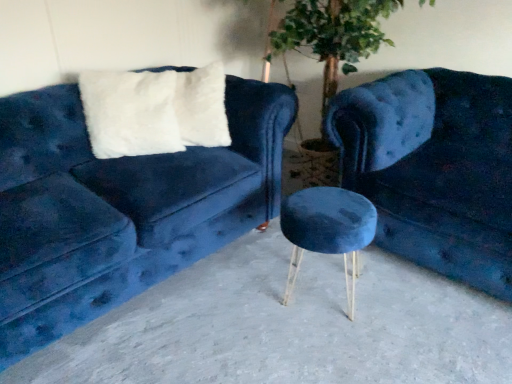
The height and width of the screenshot is (384, 512). In order to click on smooth concrete stool at center in this screenshot , I will do `click(286, 327)`.

You are a GUI agent. You are given a task and a screenshot of the screen. Output one action in this format:
    pyautogui.click(x=<x>, y=<y>)
    Task: Click on the velvet blue couch at center, placed as the second studio couch when sorted from left to right
    The height and width of the screenshot is (384, 512).
    Given the screenshot: What is the action you would take?
    pyautogui.click(x=434, y=169)

The height and width of the screenshot is (384, 512). What do you see at coordinates (120, 207) in the screenshot?
I see `velvet blue couch at left, marked as the 2th studio couch in a right-to-left arrangement` at bounding box center [120, 207].

Image resolution: width=512 pixels, height=384 pixels. In order to click on white fluffy pillow at upper left in this screenshot , I will do `click(202, 106)`.

Would you say white fluffy pillow at upper left contains velvet blue couch at center, placed as the second studio couch when sorted from left to right?

Definitely not — velvet blue couch at center, placed as the second studio couch when sorted from left to right, is not inside white fluffy pillow at upper left.

Between white fluffy pillow at upper left and velvet blue couch at center, the first studio couch viewed from the right, which one is positioned behind?

white fluffy pillow at upper left is further from the camera.

This screenshot has height=384, width=512. What are the coordinates of `the 1st studio couch in front when counting from the white fluffy pillow at upper left` in the screenshot? It's located at (434, 169).

From a real-world perspective, which is physically below, white fluffy pillow at upper left or velvet blue couch at center, the first studio couch viewed from the right?

From a 3D spatial view, velvet blue couch at center, the first studio couch viewed from the right, is below.

Considering the positions of objects smooth concrete stool at center and velvet blue stool at center in the image provided, who is more to the left, smooth concrete stool at center or velvet blue stool at center?

smooth concrete stool at center is more to the left.

This screenshot has width=512, height=384. In order to click on bar stool behind the smooth concrete stool at center in this screenshot , I will do `click(327, 230)`.

Considering the sizes of objects smooth concrete stool at center and velvet blue stool at center in the image provided, who is wider, smooth concrete stool at center or velvet blue stool at center?

Wider between the two is smooth concrete stool at center.

Is smooth concrete stool at center oriented away from velvet blue stool at center?

smooth concrete stool at center does not have its back to velvet blue stool at center.

Is velvet blue couch at left, which is counted as the 1th studio couch, starting from the left, not inside velvet blue couch at center, placed as the second studio couch when sorted from left to right?

Yes, velvet blue couch at left, which is counted as the 1th studio couch, starting from the left, is outside of velvet blue couch at center, placed as the second studio couch when sorted from left to right.

In terms of height, does velvet blue couch at left, marked as the 2th studio couch in a right-to-left arrangement, look taller or shorter compared to velvet blue couch at center, placed as the second studio couch when sorted from left to right?

In the image, velvet blue couch at left, marked as the 2th studio couch in a right-to-left arrangement, appears to be taller than velvet blue couch at center, placed as the second studio couch when sorted from left to right.

Does point (17, 321) come behind point (410, 143)?

No, (17, 321) is closer to viewer.

Which studio couch is the 2nd one when counting from the front of the white fluffy pillow at upper left? Please provide its 2D coordinates.

[(120, 207)]

Which is behind, point (70, 92) or point (224, 83)?

Point (224, 83)

From a real-world perspective, is velvet blue couch at left, which is counted as the 1th studio couch, starting from the left, physically below white fluffy pillow at upper left?

Yes, from a real-world perspective, velvet blue couch at left, which is counted as the 1th studio couch, starting from the left, is beneath white fluffy pillow at upper left.

Who is taller, velvet blue couch at left, marked as the 2th studio couch in a right-to-left arrangement, or white fluffy pillow at upper left?

Standing taller between the two is velvet blue couch at left, marked as the 2th studio couch in a right-to-left arrangement.

Is velvet blue stool at center aimed at velvet blue couch at center, placed as the second studio couch when sorted from left to right?

No.

Considering the sizes of velvet blue stool at center and velvet blue couch at center, the first studio couch viewed from the right, in the image, is velvet blue stool at center wider or thinner than velvet blue couch at center, the first studio couch viewed from the right,?

In the image, velvet blue stool at center appears to be more narrow than velvet blue couch at center, the first studio couch viewed from the right.

Is velvet blue stool at center positioned before velvet blue couch at center, the first studio couch viewed from the right?

That is False.

Is there a large distance between white fluffy pillow at upper left and smooth concrete stool at center?

Actually, white fluffy pillow at upper left and smooth concrete stool at center are a little close together.

From the image's perspective, is white fluffy pillow at upper left located beneath smooth concrete stool at center?

No, from the image's perspective, white fluffy pillow at upper left is not below smooth concrete stool at center.

Is white fluffy pillow at upper left looking in the opposite direction of smooth concrete stool at center?

No.

Based on the photo, considering the relative positions of white fluffy pillow at upper left and smooth concrete stool at center in the image provided, is white fluffy pillow at upper left in front of smooth concrete stool at center?

No, it is behind smooth concrete stool at center.

Does velvet blue couch at center, the first studio couch viewed from the right, have a lesser width compared to white fluffy pillow at upper left?

In fact, velvet blue couch at center, the first studio couch viewed from the right, might be wider than white fluffy pillow at upper left.

From the picture: Is velvet blue couch at center, placed as the second studio couch when sorted from left to right, beside white fluffy pillow at upper left?

No, velvet blue couch at center, placed as the second studio couch when sorted from left to right, is not touching white fluffy pillow at upper left.

Is point (428, 130) closer to camera compared to point (213, 92)?

No, (428, 130) is further to viewer.

From a real-world perspective, is velvet blue couch at center, placed as the second studio couch when sorted from left to right, over white fluffy pillow at upper left?

No, from a real-world perspective, velvet blue couch at center, placed as the second studio couch when sorted from left to right, is not over white fluffy pillow at upper left

The width and height of the screenshot is (512, 384). In order to click on pillow behind the velvet blue couch at center, the first studio couch viewed from the right in this screenshot , I will do `click(202, 106)`.

Where is `bar stool above the smooth concrete stool at center (from a real-world perspective)`? bar stool above the smooth concrete stool at center (from a real-world perspective) is located at coordinates (327, 230).

When comparing their distances from velvet blue couch at center, the first studio couch viewed from the right, does velvet blue stool at center or white fluffy pillow at upper left seem closer?

velvet blue stool at center lies closer to velvet blue couch at center, the first studio couch viewed from the right, than the other object.

Looking at the image, which one is located further to velvet blue stool at center, smooth concrete stool at center or velvet blue couch at left, which is counted as the 1th studio couch, starting from the left?

velvet blue couch at left, which is counted as the 1th studio couch, starting from the left.

Which object lies further to the anchor point velvet blue couch at left, marked as the 2th studio couch in a right-to-left arrangement, smooth concrete stool at center or velvet blue stool at center?

A: Based on the image, velvet blue stool at center appears to be further to velvet blue couch at left, marked as the 2th studio couch in a right-to-left arrangement.

Looking at this image, from the image, which object appears to be farther from white fluffy pillow at upper left, velvet blue couch at center, the first studio couch viewed from the right, or velvet blue couch at left, marked as the 2th studio couch in a right-to-left arrangement?

velvet blue couch at center, the first studio couch viewed from the right, lies further to white fluffy pillow at upper left than the other object.

Which object lies nearer to the anchor point white fluffy pillow at upper left, smooth concrete stool at center or velvet blue stool at center?

velvet blue stool at center lies closer to white fluffy pillow at upper left than the other object.

Which object lies nearer to the anchor point velvet blue stool at center, white fluffy pillow at upper left or velvet blue couch at center, the first studio couch viewed from the right?

velvet blue couch at center, the first studio couch viewed from the right, lies closer to velvet blue stool at center than the other object.

Based on their spatial positions, is velvet blue stool at center or velvet blue couch at left, which is counted as the 1th studio couch, starting from the left, further from smooth concrete stool at center?

Among the two, velvet blue couch at left, which is counted as the 1th studio couch, starting from the left, is located further to smooth concrete stool at center.

From the image, which object appears to be nearer to smooth concrete stool at center, velvet blue stool at center or white fluffy pillow at upper left?

Answer: velvet blue stool at center.

You are a GUI agent. You are given a task and a screenshot of the screen. Output one action in this format:
    pyautogui.click(x=<x>, y=<y>)
    Task: Click on the bar stool between white fluffy pillow at upper left and velvet blue couch at center, the first studio couch viewed from the right, from left to right
    The width and height of the screenshot is (512, 384).
    Given the screenshot: What is the action you would take?
    pyautogui.click(x=327, y=230)

Locate an element on the screen. pillow situated between velvet blue couch at left, marked as the 2th studio couch in a right-to-left arrangement, and velvet blue stool at center from left to right is located at coordinates (202, 106).

The height and width of the screenshot is (384, 512). In order to click on bar stool positioned between smooth concrete stool at center and white fluffy pillow at upper left from near to far in this screenshot , I will do `click(327, 230)`.

This screenshot has height=384, width=512. Identify the location of bar stool between velvet blue couch at left, which is counted as the 1th studio couch, starting from the left, and velvet blue couch at center, placed as the second studio couch when sorted from left to right, in the horizontal direction. (327, 230).